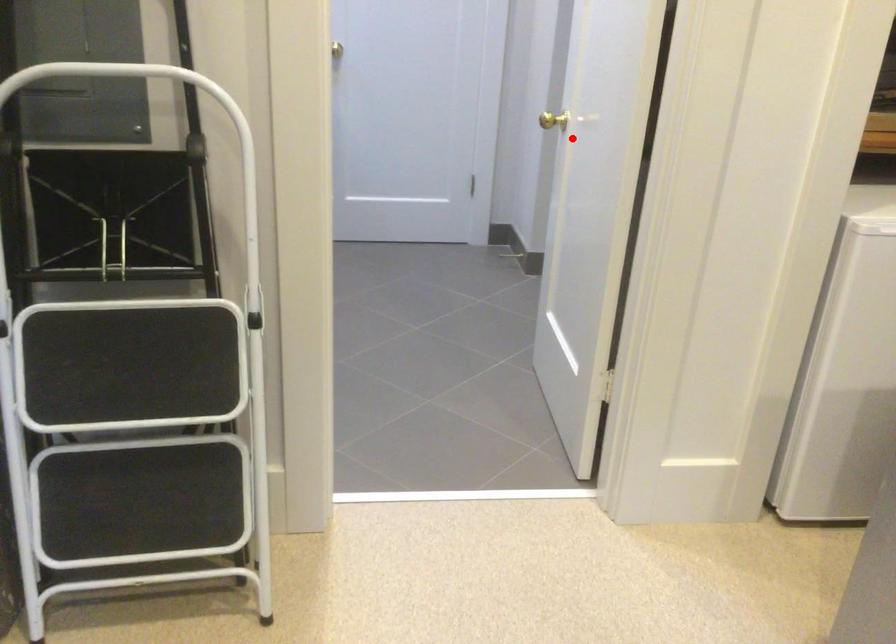
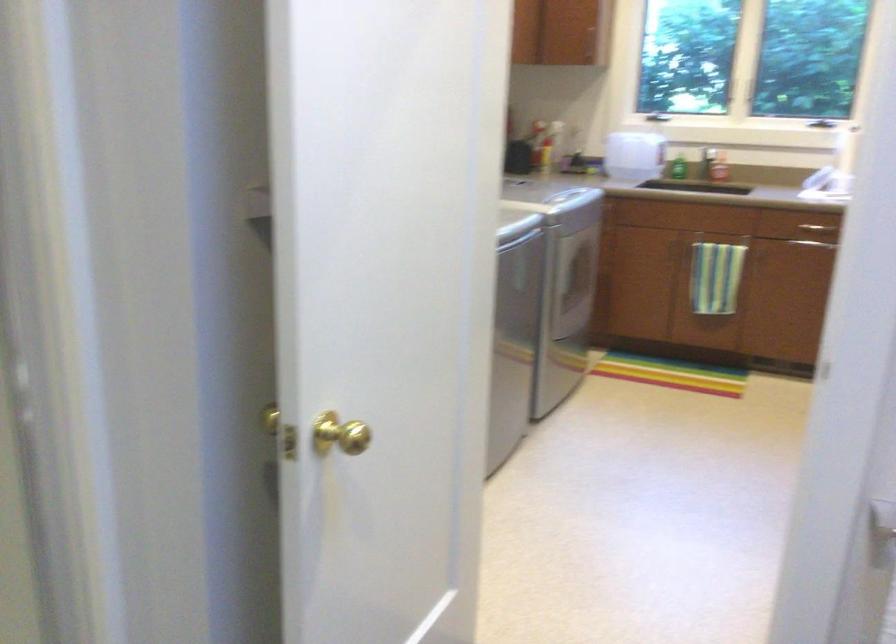
Question: A red point is marked in image1. In image2, is the corresponding 3D point closer to the camera or farther? Reply with the corresponding letter.

Choices:
 (A) The corresponding 3D point is closer.
 (B) The corresponding 3D point is farther.

Answer: (A)